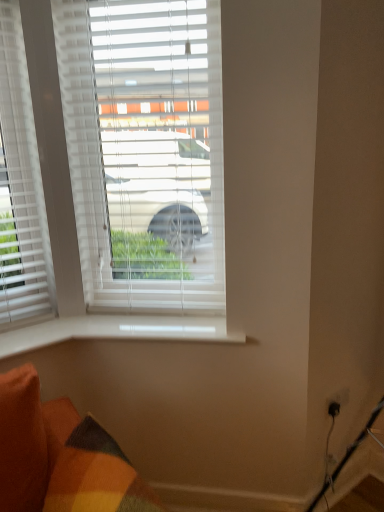
Question: Is white smooth window sill at lower center taller or shorter than white plastic blinds at center?

Choices:
 (A) short
 (B) tall

Answer: (A)

Question: Looking at their shapes, would you say white smooth window sill at lower center is wider or thinner than white plastic blinds at center?

Choices:
 (A) thin
 (B) wide

Answer: (B)

Question: From the image's perspective, is white smooth window sill at lower center positioned above or below white plastic blinds at center?

Choices:
 (A) above
 (B) below

Answer: (B)

Question: Choose the correct answer: Is white plastic blinds at center inside white smooth window sill at lower center or outside it?

Choices:
 (A) outside
 (B) inside

Answer: (A)

Question: Considering the positions of white plastic blinds at center and white smooth window sill at lower center in the image, is white plastic blinds at center taller or shorter than white smooth window sill at lower center?

Choices:
 (A) short
 (B) tall

Answer: (B)

Question: Is point (86, 106) closer or farther from the camera than point (11, 344)?

Choices:
 (A) farther
 (B) closer

Answer: (A)

Question: In terms of size, does white plastic blinds at center appear bigger or smaller than white smooth window sill at lower center?

Choices:
 (A) big
 (B) small

Answer: (A)